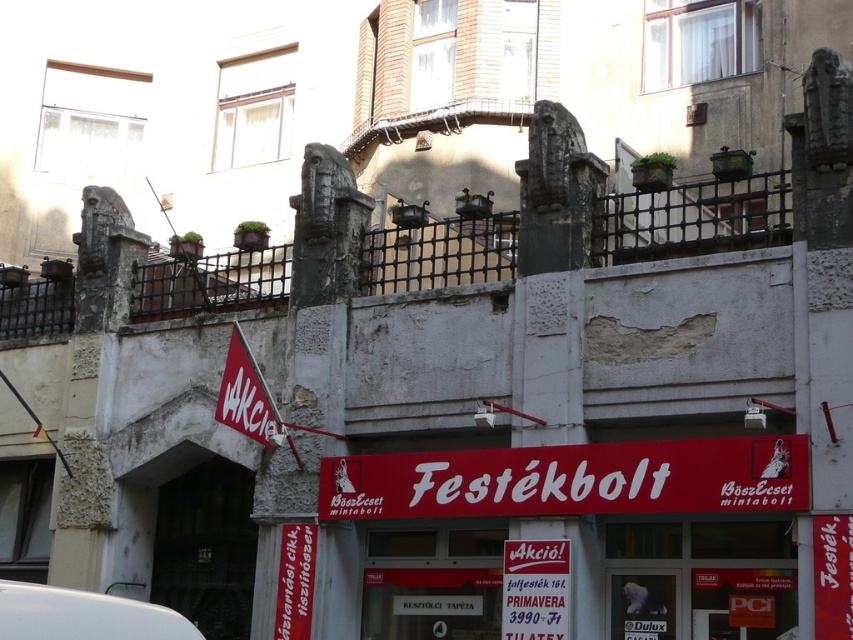
Question: From the image, what is the correct spatial relationship of red matte sign at center in relation to white paper sign at center?

Choices:
 (A) right
 (B) left

Answer: (A)

Question: Estimate the real-world distances between objects in this image. Which object is closer to the white paper sign at center?

Choices:
 (A) red matte sign at center
 (B) red fabric sign at lower left
 (C) white paper banner at center

Answer: (A)

Question: Does white matte van at lower left have a smaller size compared to white paper sign at center?

Choices:
 (A) yes
 (B) no

Answer: (B)

Question: Can you confirm if red matte sign at center is positioned to the right of white paper sign at center?

Choices:
 (A) yes
 (B) no

Answer: (A)

Question: Estimate the real-world distances between objects in this image. Which object is farther from the white paper banner at center?

Choices:
 (A) white matte van at lower left
 (B) red matte sign at center

Answer: (A)

Question: Which object is positioned closest to the white paper sign at center?

Choices:
 (A) red matte sign at center
 (B) white matte van at lower left
 (C) red fabric sign at lower left
 (D) white paper banner at center

Answer: (A)